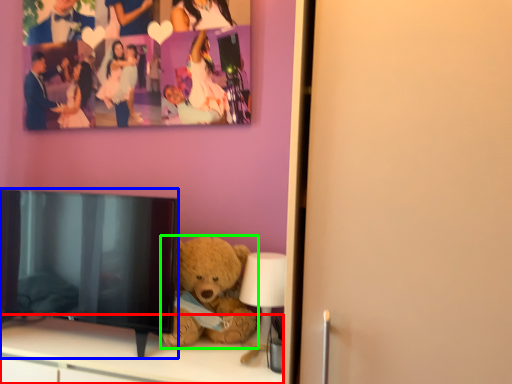
Question: Considering the real-world distances, which object is closest to furniture (highlighted by a red box)? television (highlighted by a blue box) or teddy bear (highlighted by a green box).

Choices:
 (A) television
 (B) teddy bear

Answer: (A)